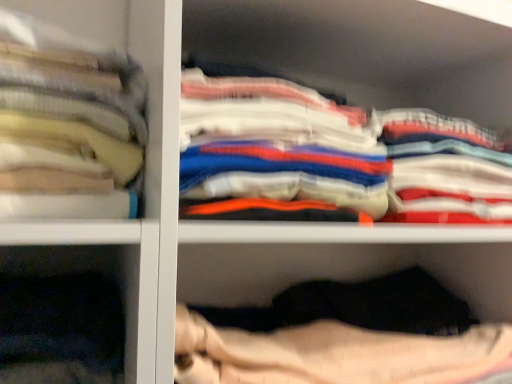
What do you see at coordinates (70, 133) in the screenshot?
I see `soft cotton towels at left, which appears as the 1th clothing when viewed from the left` at bounding box center [70, 133].

Measure the distance between white cotton shirts at center, placed as the second clothing when sorted from right to left, and camera.

The distance of white cotton shirts at center, placed as the second clothing when sorted from right to left, from camera is 19.21 inches.

Image resolution: width=512 pixels, height=384 pixels. I want to click on white cotton shirts at upper right, the 3th clothing in the left-to-right sequence, so pos(445,169).

What do you see at coordinates (445, 169) in the screenshot? Image resolution: width=512 pixels, height=384 pixels. I see `white cotton shirts at upper right, the 1th clothing when ordered from right to left` at bounding box center [445, 169].

This screenshot has height=384, width=512. I want to click on soft cotton towels at left, arranged as the third clothing when viewed from the right, so click(70, 133).

Does soft cotton towels at left, arranged as the third clothing when viewed from the right, touch white cotton shirts at center, placed as the second clothing when sorted from right to left?

soft cotton towels at left, arranged as the third clothing when viewed from the right, is not next to white cotton shirts at center, placed as the second clothing when sorted from right to left, and they're not touching.

From a real-world perspective, which is physically below, soft cotton towels at left, arranged as the third clothing when viewed from the right, or white cotton shirts at center, placed as the second clothing when sorted from right to left?

white cotton shirts at center, placed as the second clothing when sorted from right to left.

Can you confirm if soft cotton towels at left, which appears as the 1th clothing when viewed from the left, is shorter than white cotton shirts at center, placed as the second clothing when sorted from right to left?

Incorrect, the height of soft cotton towels at left, which appears as the 1th clothing when viewed from the left, does not fall short of that of white cotton shirts at center, placed as the second clothing when sorted from right to left.

What's the angular difference between white cotton shirts at center, the second clothing viewed from the left, and soft cotton towels at left, which appears as the 1th clothing when viewed from the left,'s facing directions?

The facing directions of white cotton shirts at center, the second clothing viewed from the left, and soft cotton towels at left, which appears as the 1th clothing when viewed from the left, are 0.00352 degrees apart.

Is white cotton shirts at center, placed as the second clothing when sorted from right to left, not within soft cotton towels at left, which appears as the 1th clothing when viewed from the left?

Yes, white cotton shirts at center, placed as the second clothing when sorted from right to left, is outside of soft cotton towels at left, which appears as the 1th clothing when viewed from the left.

Is white cotton shirts at center, the second clothing viewed from the left, to the left of soft cotton towels at left, which appears as the 1th clothing when viewed from the left, from the viewer's perspective?

In fact, white cotton shirts at center, the second clothing viewed from the left, is to the right of soft cotton towels at left, which appears as the 1th clothing when viewed from the left.

Which point is more forward, (227,103) or (14,156)?

Point (14,156)

Between white cotton shirts at upper right, the 3th clothing in the left-to-right sequence, and white cotton shirts at center, placed as the second clothing when sorted from right to left, which one appears on the right side from the viewer's perspective?

white cotton shirts at upper right, the 3th clothing in the left-to-right sequence, is more to the right.

From a real-world perspective, is white cotton shirts at upper right, the 3th clothing in the left-to-right sequence, beneath white cotton shirts at center, placed as the second clothing when sorted from right to left?

Correct, in the physical world, white cotton shirts at upper right, the 3th clothing in the left-to-right sequence, is lower than white cotton shirts at center, placed as the second clothing when sorted from right to left.

Between white cotton shirts at upper right, the 1th clothing when ordered from right to left, and white cotton shirts at center, the second clothing viewed from the left, which one has smaller width?

white cotton shirts at upper right, the 1th clothing when ordered from right to left.

Image resolution: width=512 pixels, height=384 pixels. Identify the location of clothing that is the 2nd object located in front of the white cotton shirts at upper right, the 3th clothing in the left-to-right sequence. (70, 133).

From a real-world perspective, is soft cotton towels at left, arranged as the third clothing when viewed from the right, physically located above or below white cotton shirts at upper right, the 3th clothing in the left-to-right sequence?

soft cotton towels at left, arranged as the third clothing when viewed from the right, is situated higher than white cotton shirts at upper right, the 3th clothing in the left-to-right sequence, in the real world.

How different are the orientations of soft cotton towels at left, which appears as the 1th clothing when viewed from the left, and white cotton shirts at upper right, the 1th clothing when ordered from right to left, in degrees?

The facing directions of soft cotton towels at left, which appears as the 1th clothing when viewed from the left, and white cotton shirts at upper right, the 1th clothing when ordered from right to left, are 5.27e-05 degrees apart.

How far apart are soft cotton towels at left, which appears as the 1th clothing when viewed from the left, and white cotton shirts at upper right, the 1th clothing when ordered from right to left?

A distance of 43.33 centimeters exists between soft cotton towels at left, which appears as the 1th clothing when viewed from the left, and white cotton shirts at upper right, the 1th clothing when ordered from right to left.

Between white cotton shirts at upper right, the 3th clothing in the left-to-right sequence, and soft cotton towels at left, which appears as the 1th clothing when viewed from the left, which one appears on the left side from the viewer's perspective?

Positioned to the left is soft cotton towels at left, which appears as the 1th clothing when viewed from the left.

What's the angular difference between white cotton shirts at upper right, the 1th clothing when ordered from right to left, and soft cotton towels at left, arranged as the third clothing when viewed from the right,'s facing directions?

5.27e-05 degrees.

Who is smaller, white cotton shirts at upper right, the 1th clothing when ordered from right to left, or soft cotton towels at left, which appears as the 1th clothing when viewed from the left?

soft cotton towels at left, which appears as the 1th clothing when viewed from the left.

The height and width of the screenshot is (384, 512). I want to click on the 2nd clothing positioned above the white cotton shirts at upper right, the 1th clothing when ordered from right to left (from the image's perspective), so click(70, 133).

Where is `clothing that is below the white cotton shirts at center, placed as the second clothing when sorted from right to left (from the image's perspective)`? Image resolution: width=512 pixels, height=384 pixels. clothing that is below the white cotton shirts at center, placed as the second clothing when sorted from right to left (from the image's perspective) is located at coordinates (445, 169).

Consider the image. Considering the relative positions of white cotton shirts at center, the second clothing viewed from the left, and white cotton shirts at upper right, the 1th clothing when ordered from right to left, in the image provided, is white cotton shirts at center, the second clothing viewed from the left, to the right of white cotton shirts at upper right, the 1th clothing when ordered from right to left, from the viewer's perspective?

No.

Which point is more forward, (250, 194) or (463, 129)?

Positioned in front is point (250, 194).

Does white cotton shirts at center, placed as the second clothing when sorted from right to left, have a greater height compared to white cotton shirts at upper right, the 3th clothing in the left-to-right sequence?

Yes, white cotton shirts at center, placed as the second clothing when sorted from right to left, is taller than white cotton shirts at upper right, the 3th clothing in the left-to-right sequence.

Identify the location of clothing in front of the white cotton shirts at center, the second clothing viewed from the left. The height and width of the screenshot is (384, 512). (70, 133).

I want to click on clothing that is the 1st one when counting downward from the soft cotton towels at left, arranged as the third clothing when viewed from the right (from the image's perspective), so pos(335,152).

Estimate the real-world distances between objects in this image. Which object is closer to soft cotton towels at left, arranged as the third clothing when viewed from the right, white cotton shirts at upper right, the 3th clothing in the left-to-right sequence, or white cotton shirts at center, the second clothing viewed from the left?

white cotton shirts at center, the second clothing viewed from the left, is closer to soft cotton towels at left, arranged as the third clothing when viewed from the right.

Considering their positions, is soft cotton towels at left, arranged as the third clothing when viewed from the right, positioned closer to white cotton shirts at center, placed as the second clothing when sorted from right to left, than white cotton shirts at upper right, the 1th clothing when ordered from right to left?

Based on the image, white cotton shirts at upper right, the 1th clothing when ordered from right to left, appears to be nearer to white cotton shirts at center, placed as the second clothing when sorted from right to left.

Looking at the image, which one is located closer to white cotton shirts at upper right, the 1th clothing when ordered from right to left, white cotton shirts at center, placed as the second clothing when sorted from right to left, or soft cotton towels at left, which appears as the 1th clothing when viewed from the left?

The object closer to white cotton shirts at upper right, the 1th clothing when ordered from right to left, is white cotton shirts at center, placed as the second clothing when sorted from right to left.

Considering their positions, is white cotton shirts at center, the second clothing viewed from the left, positioned closer to soft cotton towels at left, which appears as the 1th clothing when viewed from the left, than white cotton shirts at upper right, the 3th clothing in the left-to-right sequence?

white cotton shirts at center, the second clothing viewed from the left, is closer to soft cotton towels at left, which appears as the 1th clothing when viewed from the left.

Which object lies nearer to the anchor point white cotton shirts at upper right, the 3th clothing in the left-to-right sequence, soft cotton towels at left, arranged as the third clothing when viewed from the right, or white cotton shirts at center, placed as the second clothing when sorted from right to left?

The object closer to white cotton shirts at upper right, the 3th clothing in the left-to-right sequence, is white cotton shirts at center, placed as the second clothing when sorted from right to left.

When comparing their distances from white cotton shirts at center, the second clothing viewed from the left, does white cotton shirts at upper right, the 3th clothing in the left-to-right sequence, or soft cotton towels at left, arranged as the third clothing when viewed from the right, seem closer?

The object closer to white cotton shirts at center, the second clothing viewed from the left, is white cotton shirts at upper right, the 3th clothing in the left-to-right sequence.

The height and width of the screenshot is (384, 512). I want to click on clothing between soft cotton towels at left, arranged as the third clothing when viewed from the right, and white cotton shirts at upper right, the 3th clothing in the left-to-right sequence, from left to right, so click(x=335, y=152).